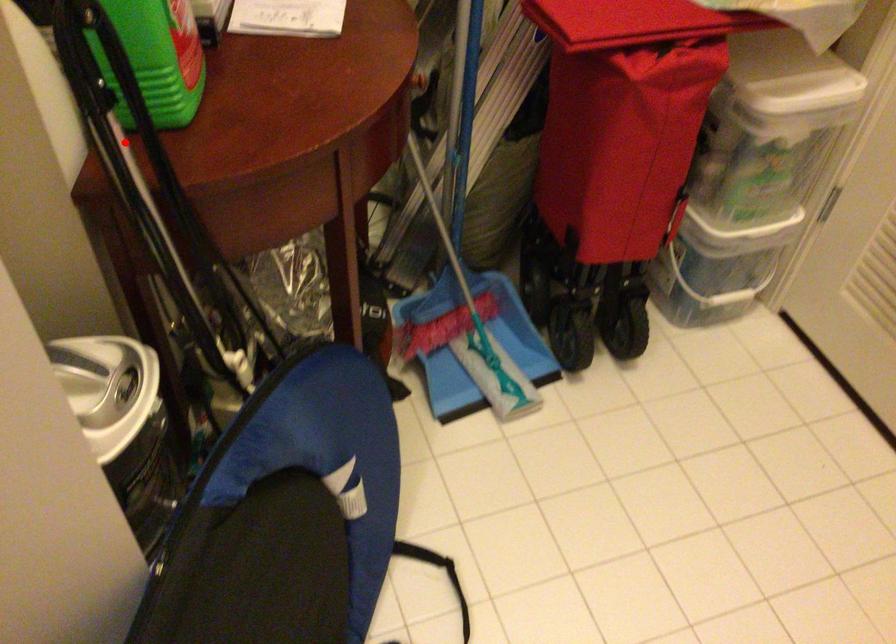
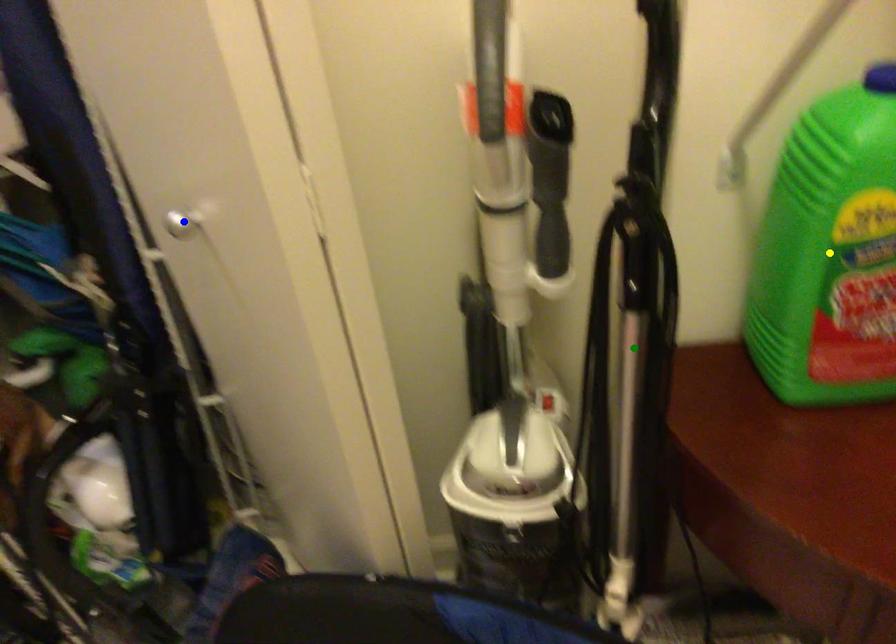
Question: I am providing you with two images of the same scene from different viewpoints. A red point is marked on the first image. You are given multiple points on the second image. Which mark in image 2 goes with the point in image 1?

Choices:
 (A) yellow point
 (B) blue point
 (C) green point

Answer: (C)